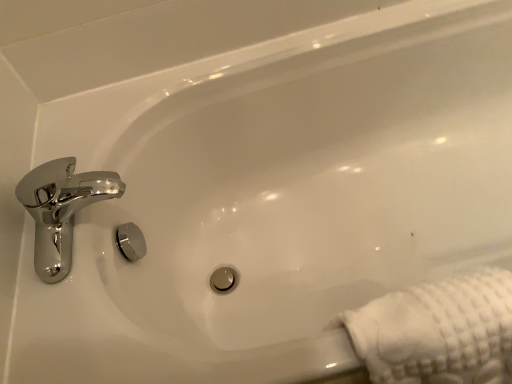
The height and width of the screenshot is (384, 512). What do you see at coordinates (61, 209) in the screenshot?
I see `chrome/metallic faucet at upper left` at bounding box center [61, 209].

Where is `chrome/metallic faucet at upper left`? The image size is (512, 384). chrome/metallic faucet at upper left is located at coordinates (61, 209).

Where is `white textured towel at lower right`? Image resolution: width=512 pixels, height=384 pixels. white textured towel at lower right is located at coordinates (437, 331).

What do you see at coordinates (437, 331) in the screenshot?
I see `white textured towel at lower right` at bounding box center [437, 331].

At what (x,y) coordinates should I click in order to perform the action: click on chrome/metallic faucet at upper left. Please return your answer as a coordinate pair (x, y). The image size is (512, 384). Looking at the image, I should click on (61, 209).

From the picture: Is white textured towel at lower right to the right of chrome/metallic faucet at upper left from the viewer's perspective?

Indeed, white textured towel at lower right is positioned on the right side of chrome/metallic faucet at upper left.

Who is more distant, white textured towel at lower right or chrome/metallic faucet at upper left?

chrome/metallic faucet at upper left.

Between point (378, 357) and point (45, 166), which one is positioned behind?

Point (45, 166)

From the image's perspective, which is above, white textured towel at lower right or chrome/metallic faucet at upper left?

chrome/metallic faucet at upper left is shown above in the image.

From a real-world perspective, is white textured towel at lower right above or below chrome/metallic faucet at upper left?

Clearly, from a real-world perspective, white textured towel at lower right is below chrome/metallic faucet at upper left.

Considering the relative sizes of white textured towel at lower right and chrome/metallic faucet at upper left in the image provided, is white textured towel at lower right thinner than chrome/metallic faucet at upper left?

Correct, the width of white textured towel at lower right is less than that of chrome/metallic faucet at upper left.

Does white textured towel at lower right have a lesser height compared to chrome/metallic faucet at upper left?

No, white textured towel at lower right is not shorter than chrome/metallic faucet at upper left.

Can you confirm if white textured towel at lower right is smaller than chrome/metallic faucet at upper left?

No.

Is chrome/metallic faucet at upper left inside white textured towel at lower right?

Actually, chrome/metallic faucet at upper left is outside white textured towel at lower right.

Would you consider white textured towel at lower right to be distant from chrome/metallic faucet at upper left?

No, there isn't a large distance between white textured towel at lower right and chrome/metallic faucet at upper left.

Is white textured towel at lower right oriented towards chrome/metallic faucet at upper left?

No, white textured towel at lower right is not facing towards chrome/metallic faucet at upper left.

How different are the orientations of white textured towel at lower right and chrome/metallic faucet at upper left in degrees?

86.5 degrees separate the facing orientations of white textured towel at lower right and chrome/metallic faucet at upper left.

This screenshot has height=384, width=512. I want to click on bath towel that appears on the right of chrome/metallic faucet at upper left, so tap(437, 331).

Which object is positioned more to the left, chrome/metallic faucet at upper left or white textured towel at lower right?

chrome/metallic faucet at upper left.

Is chrome/metallic faucet at upper left closer to camera compared to white textured towel at lower right?

No, chrome/metallic faucet at upper left is further to the viewer.

Considering the positions of point (95, 186) and point (482, 297), is point (95, 186) closer or farther from the camera than point (482, 297)?

Point (95, 186) appears to be farther away from the viewer than point (482, 297).

From the image's perspective, which one is positioned lower, chrome/metallic faucet at upper left or white textured towel at lower right?

From the image's view, white textured towel at lower right is below.

From a real-world perspective, does chrome/metallic faucet at upper left stand above white textured towel at lower right?

Yes, from a real-world perspective, chrome/metallic faucet at upper left is over white textured towel at lower right

Considering the relative sizes of chrome/metallic faucet at upper left and white textured towel at lower right in the image provided, is chrome/metallic faucet at upper left thinner than white textured towel at lower right?

No.

Considering the relative sizes of chrome/metallic faucet at upper left and white textured towel at lower right in the image provided, is chrome/metallic faucet at upper left taller than white textured towel at lower right?

Incorrect, the height of chrome/metallic faucet at upper left is not larger of that of white textured towel at lower right.

Considering the sizes of objects chrome/metallic faucet at upper left and white textured towel at lower right in the image provided, who is bigger, chrome/metallic faucet at upper left or white textured towel at lower right?

white textured towel at lower right.

Is white textured towel at lower right located within chrome/metallic faucet at upper left?

No, white textured towel at lower right is not surrounded by chrome/metallic faucet at upper left.

Is chrome/metallic faucet at upper left next to white textured towel at lower right and touching it?

No, chrome/metallic faucet at upper left is not making contact with white textured towel at lower right.

Is chrome/metallic faucet at upper left positioned with its back to white textured towel at lower right?

No, chrome/metallic faucet at upper left is not facing the opposite direction of white textured towel at lower right.

How many degrees apart are the facing directions of chrome/metallic faucet at upper left and white textured towel at lower right?

chrome/metallic faucet at upper left and white textured towel at lower right are facing 86.5 degrees away from each other.

Where is `bath towel located in front of the chrome/metallic faucet at upper left`? The height and width of the screenshot is (384, 512). bath towel located in front of the chrome/metallic faucet at upper left is located at coordinates (437, 331).

You are a GUI agent. You are given a task and a screenshot of the screen. Output one action in this format:
    pyautogui.click(x=<x>, y=<y>)
    Task: Click on the bath towel in front of the chrome/metallic faucet at upper left
    This screenshot has height=384, width=512.
    Given the screenshot: What is the action you would take?
    pyautogui.click(x=437, y=331)

Identify the location of bath towel located below the chrome/metallic faucet at upper left (from the image's perspective). click(437, 331).